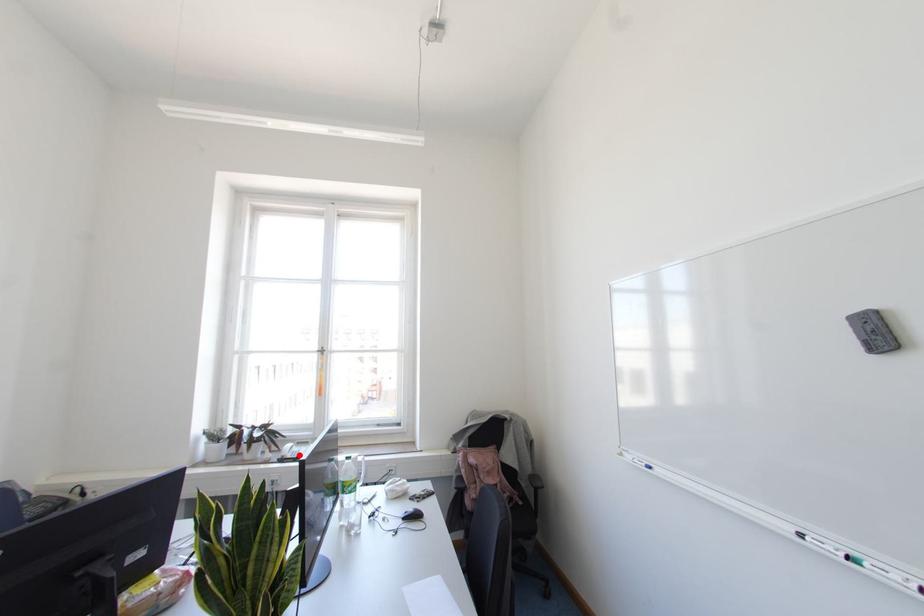
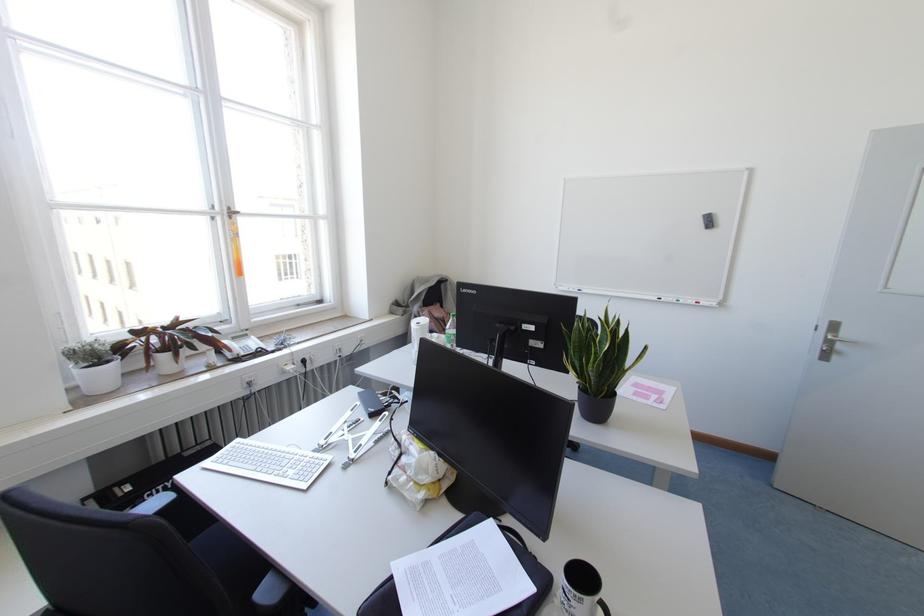
Question: I am providing you with two images of the same scene from different viewpoints. Given a red point in image1, look at the same physical point in image2. Is it:

Choices:
 (A) Closer to the viewpoint
 (B) Farther from the viewpoint

Answer: (A)